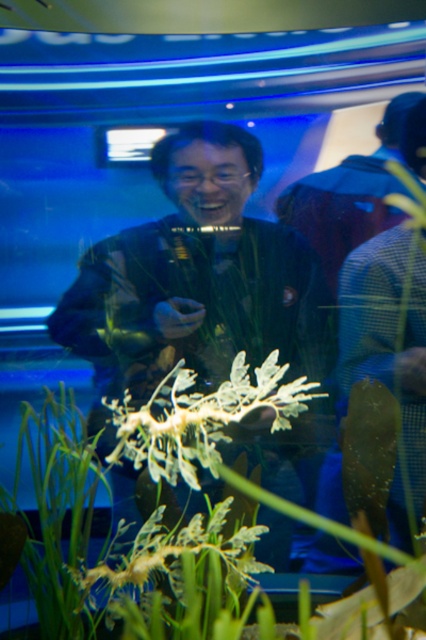
You are an underwater photographer trying to capture a clear shot of both the white leafy plant at center and the white leafy structure at center. Since both are in the center, how can you adjust your camera angle to ensure both are in focus?

The white leafy plant at center is positioned on the right side of the white leafy structure at center, so you can adjust your camera angle to the right to ensure both are in focus.

From the picture: You are an underwater photographer trying to capture a clear shot of both the white leafy plant at center and the white leafy structure at center. Since you want to focus on the plant first, which one should you adjust your camera focus on first, the one closer to you or the one further away?

The white leafy plant at center is located below the white leafy structure at center, meaning the structure is closer to you. To focus on the plant first, you should adjust your camera focus on the one further away since the plant is behind the structure.

You are an underwater photographer aiming to capture the white leafy plant at center and the white leafy structure at center in a single frame. Which one should you focus on first to ensure they are both in the frame?

You should focus on the white leafy plant at center first because it is taller than the white leafy structure at center, so adjusting the frame to include its full height will automatically include the shorter structure as well.